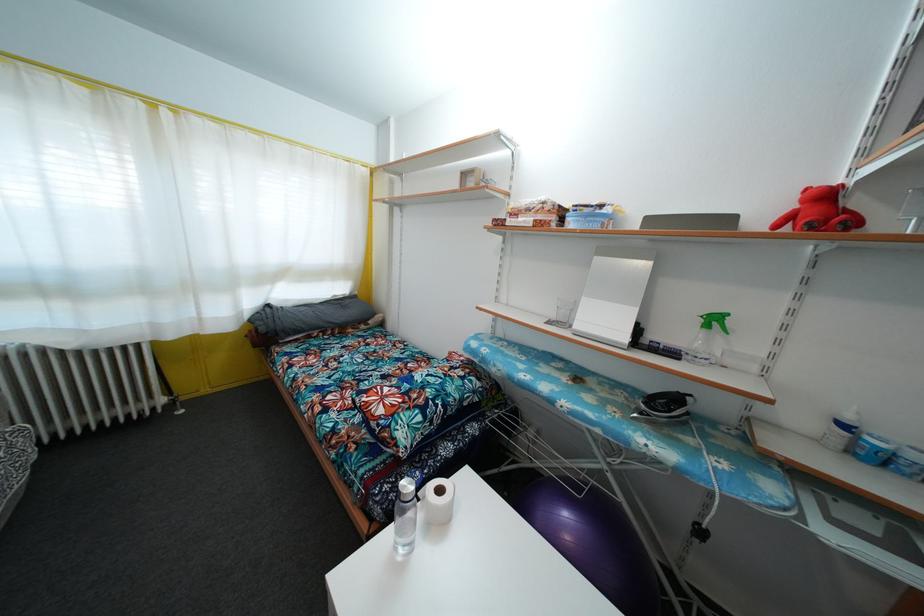
What do you see at coordinates (699, 532) in the screenshot?
I see `the black iron handle` at bounding box center [699, 532].